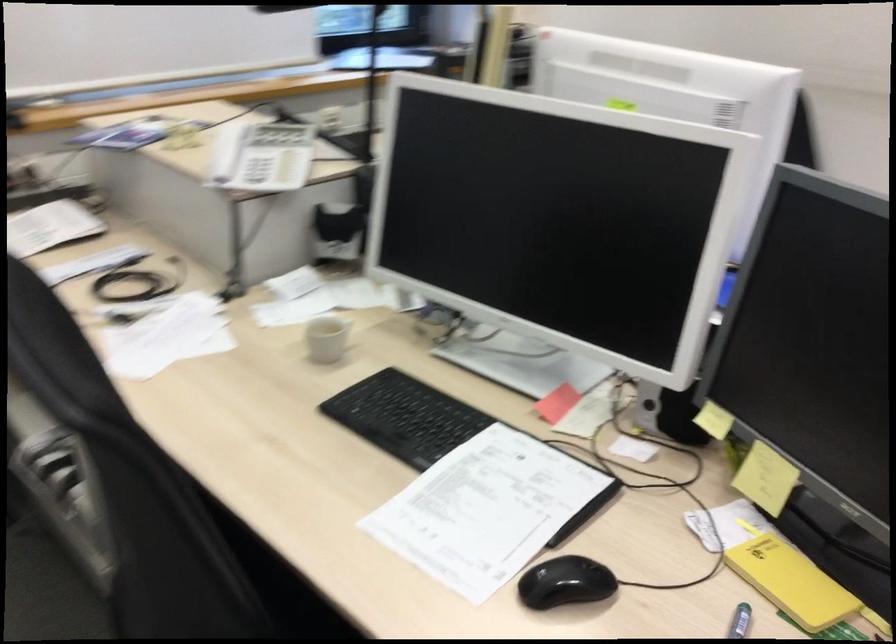
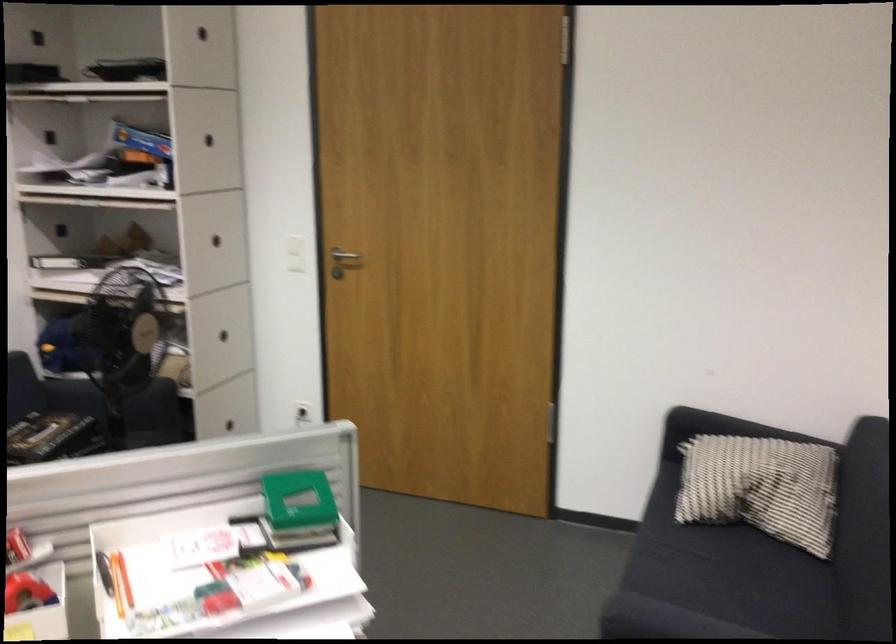
First-person continuous shooting, in which direction is the camera rotating?

The rotation direction of the camera is right-down.